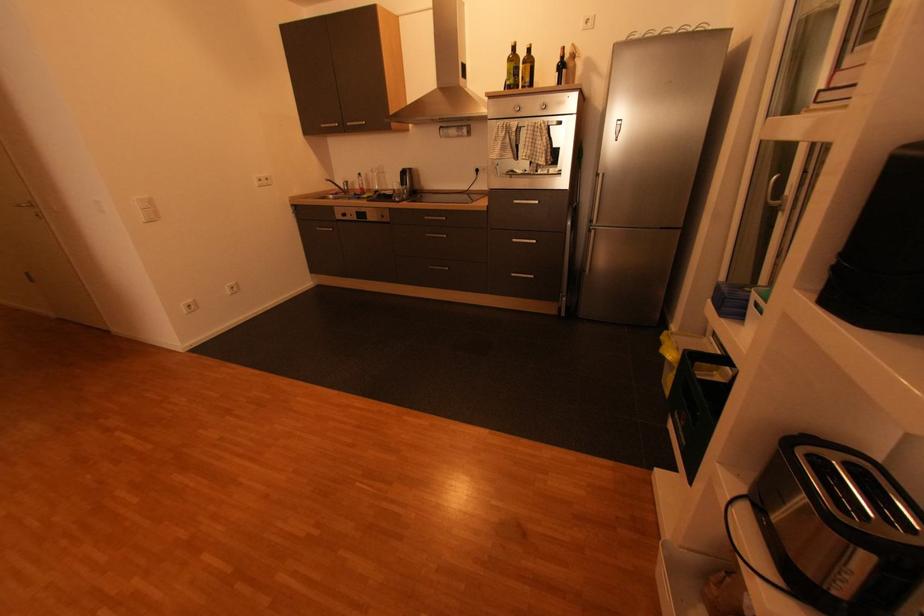
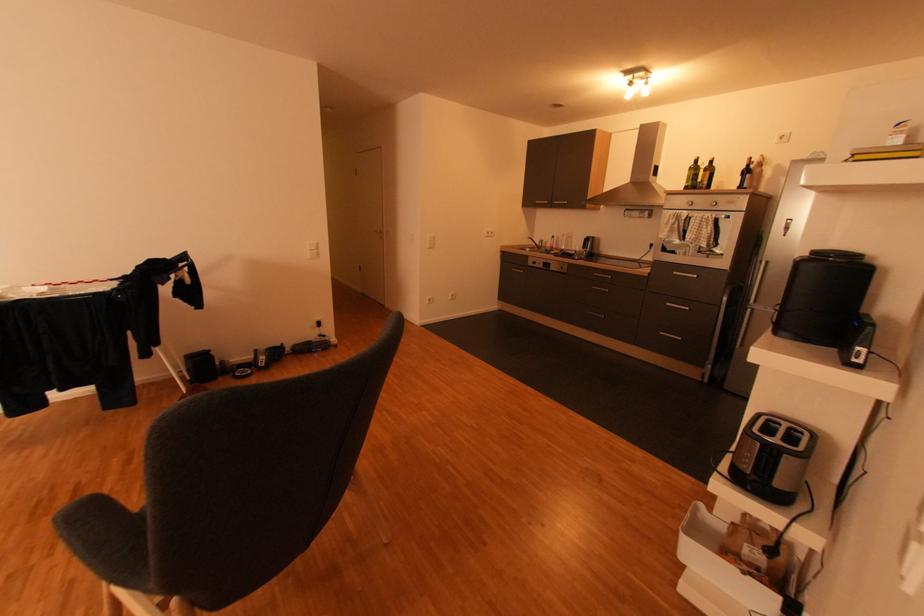
Question: Based on the continuous images, in which direction is the camera rotating? Reply with the corresponding letter.

Choices:
 (A) Left
 (B) Right
 (C) Up
 (D) Down

Answer: (A)